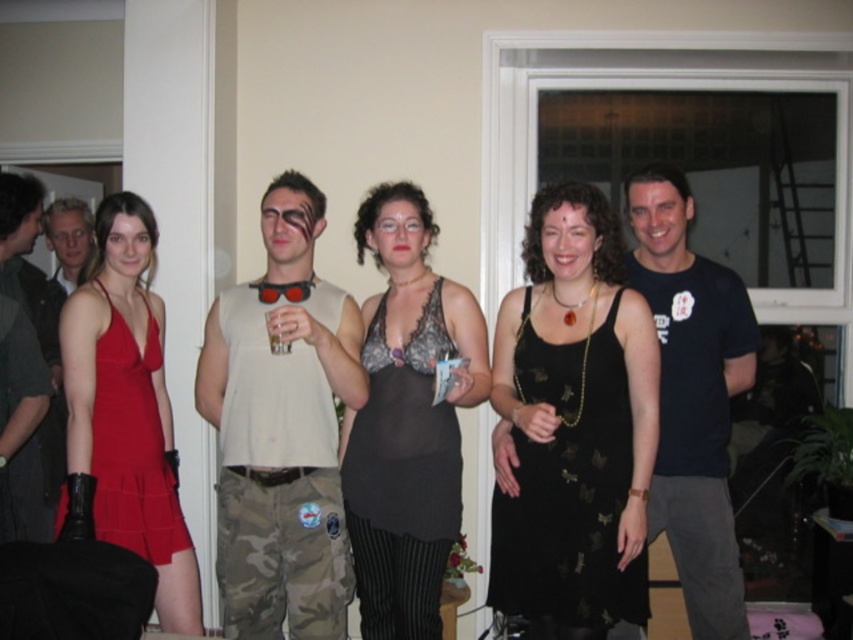
Question: Among these points, which one is farthest from the camera?

Choices:
 (A) (56, 227)
 (B) (349, 531)
 (C) (51, 298)
 (D) (341, 540)

Answer: (A)

Question: Is black lace top at center positioned behind matte red dress at left?

Choices:
 (A) no
 (B) yes

Answer: (A)

Question: Where is dark blue t-shirt at center located in relation to matte red dress at left in the image?

Choices:
 (A) left
 (B) right

Answer: (B)

Question: Which object is closer to the camera taking this photo?

Choices:
 (A) dark gray shirt at left
 (B) black lace top at center

Answer: (B)

Question: Considering the relative positions of camouflage pants at center and black lace top at center in the image provided, where is camouflage pants at center located with respect to black lace top at center?

Choices:
 (A) below
 (B) above

Answer: (B)

Question: Which point is closer to the camera?

Choices:
 (A) (30, 387)
 (B) (65, 200)

Answer: (A)